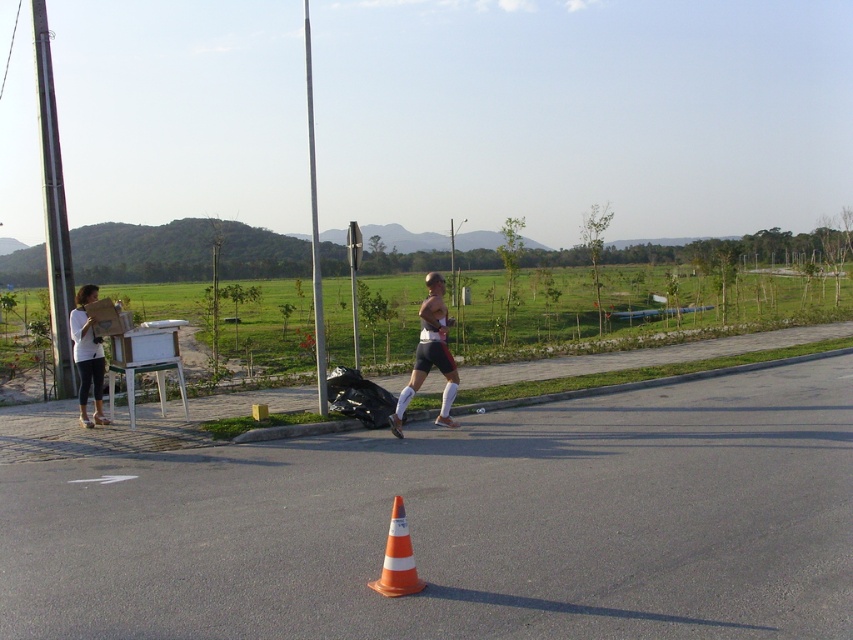
Can you confirm if matte white shorts at center is wider than white matte shirt at left?

No, matte white shorts at center is not wider than white matte shirt at left.

Describe the element at coordinates (430, 355) in the screenshot. The image size is (853, 640). I see `matte white shorts at center` at that location.

Is point (456, 426) positioned behind point (86, 420)?

Yes, point (456, 426) is behind point (86, 420).

Identify the location of matte white shorts at center. The height and width of the screenshot is (640, 853). (430, 355).

Is matte white shorts at center smaller than orange reflective cone at center?

Actually, matte white shorts at center might be larger than orange reflective cone at center.

This screenshot has width=853, height=640. In order to click on matte white shorts at center in this screenshot , I will do `click(430, 355)`.

Who is taller, white matte shirt at left or orange reflective cone at center?

white matte shirt at left

Is white matte shirt at left closer to the viewer compared to orange reflective cone at center?

No, white matte shirt at left is behind orange reflective cone at center.

Where is `white matte shirt at left`? Image resolution: width=853 pixels, height=640 pixels. white matte shirt at left is located at coordinates (86, 355).